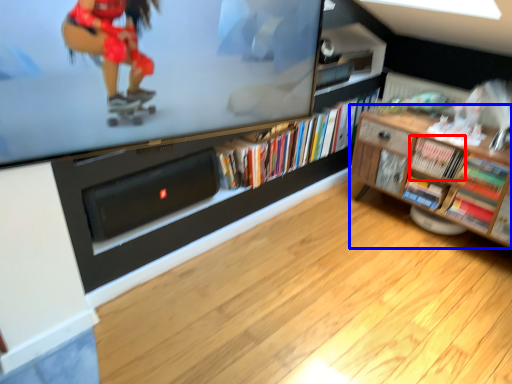
Question: Among these objects, which one is farthest to the camera, book (highlighted by a red box) or shelf (highlighted by a blue box)?

Choices:
 (A) book
 (B) shelf

Answer: (A)